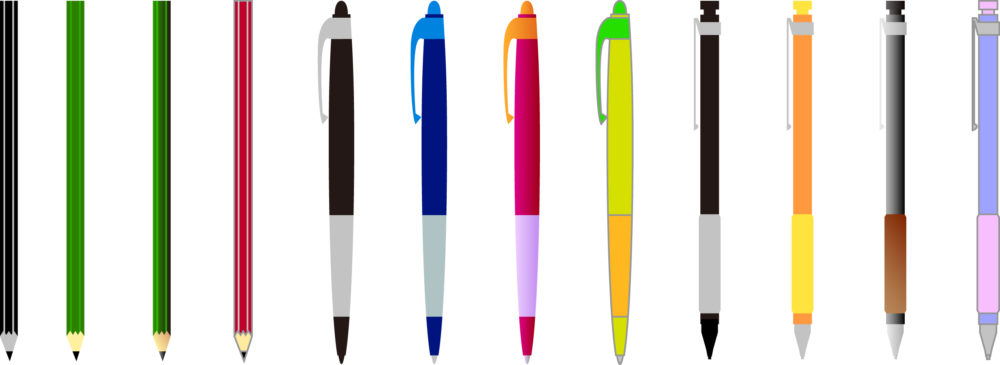
This screenshot has height=365, width=1000. What are the coordinates of `pens` in the screenshot? It's located at (340, 157), (436, 157), (529, 156), (620, 150).